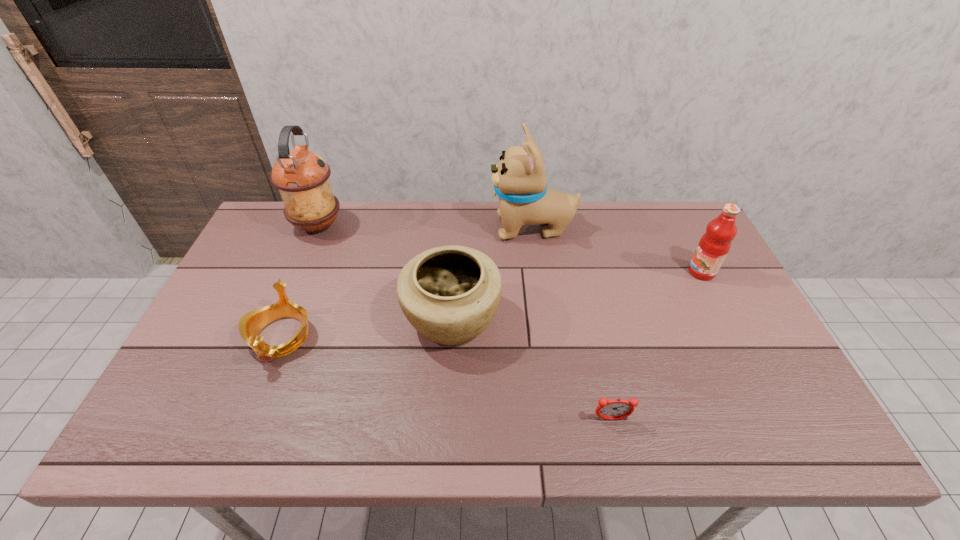
Where is `oil lamp`? The image size is (960, 540). oil lamp is located at coordinates (302, 177).

Locate an element on the screen. This screenshot has width=960, height=540. puppy is located at coordinates (519, 179).

Locate an element on the screen. Image resolution: width=960 pixels, height=540 pixels. the rightmost object is located at coordinates (714, 245).

The width and height of the screenshot is (960, 540). Find the location of `the fourth nearest object`. the fourth nearest object is located at coordinates (714, 245).

Where is `the fourth tallest object`? This screenshot has width=960, height=540. the fourth tallest object is located at coordinates pos(449,294).

The image size is (960, 540). I want to click on tiara, so [x=250, y=325].

You are a GUI agent. You are given a task and a screenshot of the screen. Output one action in this format:
    pyautogui.click(x=<x>, y=<y>)
    Task: Click on the alarm clock
    The height and width of the screenshot is (540, 960).
    Given the screenshot: What is the action you would take?
    pyautogui.click(x=615, y=409)

At what (x,y) coordinates should I click in order to perform the action: click on the shortest object. Please return your answer as a coordinate pair (x, y). This screenshot has height=540, width=960. Looking at the image, I should click on (615, 409).

This screenshot has height=540, width=960. I want to click on free spot located on the right of the oil lamp, so click(422, 226).

This screenshot has height=540, width=960. Identify the location of vacant space situated 0.250m on the face of the puppy. (414, 228).